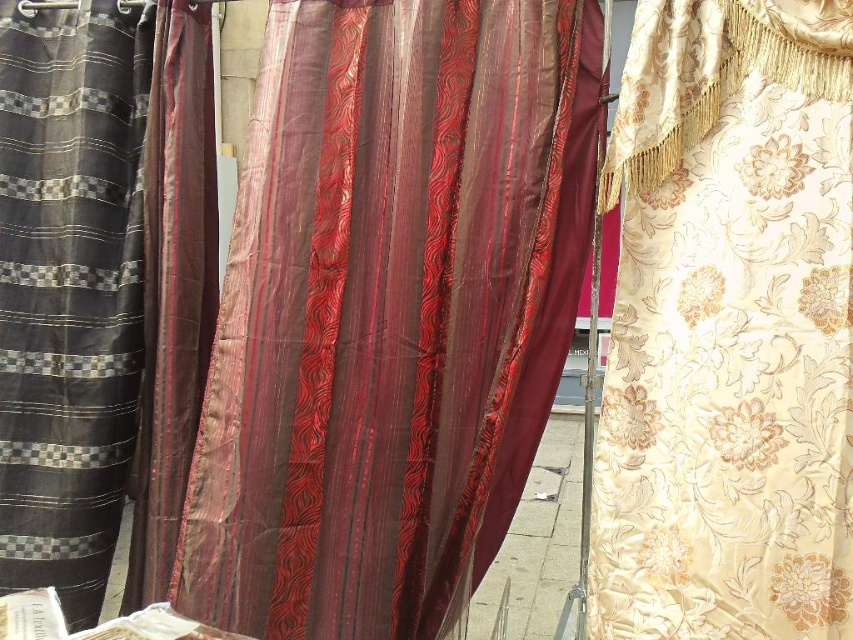
Question: Is gold floral fabric at right wider than satin-like burgundy curtain at center?

Choices:
 (A) no
 (B) yes

Answer: (B)

Question: Estimate the real-world distances between objects in this image. Which object is farther from the satin-like burgundy curtain at center?

Choices:
 (A) gold floral fabric at right
 (B) silky striped fabric at left
 (C) shiny silk curtain at center

Answer: (A)

Question: Can you confirm if gold floral fabric at right is wider than silky striped fabric at left?

Choices:
 (A) no
 (B) yes

Answer: (B)

Question: Which object is farther from the camera taking this photo?

Choices:
 (A) silky striped fabric at left
 (B) shiny silk curtain at center

Answer: (A)

Question: Can you confirm if silky striped fabric at left is wider than satin-like burgundy curtain at center?

Choices:
 (A) no
 (B) yes

Answer: (B)

Question: Which of the following is the closest to the observer?

Choices:
 (A) satin-like burgundy curtain at center
 (B) silky striped fabric at left

Answer: (A)